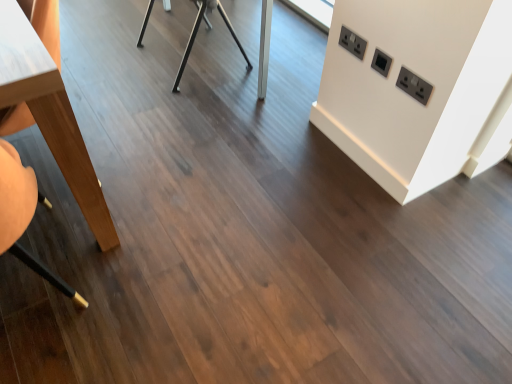
The width and height of the screenshot is (512, 384). What do you see at coordinates (54, 122) in the screenshot?
I see `light brown wood table at left, which is the 1th table in front-to-back order` at bounding box center [54, 122].

What is the approximate width of black plastic electric outlet at upper right, the 2th electric outlet from the right?

black plastic electric outlet at upper right, the 2th electric outlet from the right, is 0.39 inches in width.

What are the coordinates of `black plastic electric outlet at upper right, which ranks as the first electric outlet in bottom-to-top order` in the screenshot? It's located at (414, 86).

Identify the location of light brown wood table at left, placed as the first table when sorted from left to right. (54, 122).

From a real-world perspective, count 2nd tables downward from the black plastic electric outlet at upper right, which is the 3th electric outlet from top to bottom, and point to it. Please provide its 2D coordinates.

[(264, 47)]

Between black plastic electric outlet at upper right, which is the 3th electric outlet from top to bottom, and metallic silver table at center, the 2th table positioned from the front, which one has more height?

metallic silver table at center, the 2th table positioned from the front.

Considering the sizes of objects black plastic electric outlet at upper right, which ranks as the first electric outlet in bottom-to-top order, and metallic silver table at center, which is the 2th table from left to right, in the image provided, who is wider, black plastic electric outlet at upper right, which ranks as the first electric outlet in bottom-to-top order, or metallic silver table at center, which is the 2th table from left to right,?

metallic silver table at center, which is the 2th table from left to right, is wider.

How many degrees apart are the facing directions of black plastic electric outlet at upper right, positioned as the 1th electric outlet in right-to-left order, and metallic silver table at center, placed as the 1th table when sorted from back to front?

167 degrees.

Identify the location of swivel chair located below the black plastic electric outlet at upper right, the 2th electric outlet from the right (from the image's perspective). (23, 215).

Which is more distant, (x=11, y=174) or (x=373, y=58)?

Point (x=373, y=58)

Is wooden swivel chair at left at the left side of black plastic electric outlet at upper right, arranged as the 2th electric outlet when viewed from the left?

Indeed, wooden swivel chair at left is positioned on the left side of black plastic electric outlet at upper right, arranged as the 2th electric outlet when viewed from the left.

Considering the sizes of objects black plastic electric outlet at upper right, the 2th electric outlet from the right, and light brown wood table at left, which appears as the 2th table when viewed from the right, in the image provided, who is wider, black plastic electric outlet at upper right, the 2th electric outlet from the right, or light brown wood table at left, which appears as the 2th table when viewed from the right,?

With larger width is light brown wood table at left, which appears as the 2th table when viewed from the right.

Is point (378, 57) behind point (19, 91)?

Yes, point (378, 57) is behind point (19, 91).

How distant is black plastic electric outlet at upper right, which is counted as the 2th electric outlet, starting from the top, from light brown wood table at left, placed as the first table when sorted from left to right?

They are 1.14 meters apart.

From the picture: Between black plastic electric outlet at upper right, the 2th electric outlet from the right, and light brown wood table at left, placed as the first table when sorted from left to right, which one is positioned in front?

Positioned in front is light brown wood table at left, placed as the first table when sorted from left to right.

Between black plastic/socket at upper right, which is the 1th electric outlet in left-to-right order, and wooden swivel chair at left, which one is positioned in front?

wooden swivel chair at left is closer to the camera.

Can you confirm if black plastic/socket at upper right, which is the 1th electric outlet in left-to-right order, is bigger than wooden swivel chair at left?

Incorrect, black plastic/socket at upper right, which is the 1th electric outlet in left-to-right order, is not larger than wooden swivel chair at left.

How distant is black plastic/socket at upper right, which is the 1th electric outlet in left-to-right order, from wooden swivel chair at left?

black plastic/socket at upper right, which is the 1th electric outlet in left-to-right order, is 1.25 meters from wooden swivel chair at left.

Can you tell me how much black plastic/socket at upper right, which ranks as the first electric outlet in top-to-bottom order, and wooden swivel chair at left differ in facing direction?

They differ by 88.3 degrees in their facing directions.

Can you confirm if black plastic/socket at upper right, positioned as the 3th electric outlet in right-to-left order, is smaller than metallic silver table at center, placed as the 1th table when sorted from back to front?

Indeed, black plastic/socket at upper right, positioned as the 3th electric outlet in right-to-left order, has a smaller size compared to metallic silver table at center, placed as the 1th table when sorted from back to front.

From a real-world perspective, between black plastic/socket at upper right, which ranks as the first electric outlet in top-to-bottom order, and metallic silver table at center, the 2th table positioned from the front, who is vertically higher?

black plastic/socket at upper right, which ranks as the first electric outlet in top-to-bottom order, from a real-world perspective.

Considering the relative sizes of black plastic/socket at upper right, positioned as the 3th electric outlet in right-to-left order, and metallic silver table at center, the 2th table positioned from the front, in the image provided, is black plastic/socket at upper right, positioned as the 3th electric outlet in right-to-left order, wider than metallic silver table at center, the 2th table positioned from the front,?

Incorrect, the width of black plastic/socket at upper right, positioned as the 3th electric outlet in right-to-left order, does not surpass that of metallic silver table at center, the 2th table positioned from the front.

Does black plastic/socket at upper right, which is the 1th electric outlet in left-to-right order, appear on the left side of metallic silver table at center, placed as the 1th table when sorted from back to front?

Incorrect, black plastic/socket at upper right, which is the 1th electric outlet in left-to-right order, is not on the left side of metallic silver table at center, placed as the 1th table when sorted from back to front.

Considering the positions of point (16, 186) and point (4, 32), is point (16, 186) closer or farther from the camera than point (4, 32)?

Point (16, 186) is closer to the camera than point (4, 32).

Based on the photo, considering the relative sizes of wooden swivel chair at left and light brown wood table at left, which is the 1th table in front-to-back order, in the image provided, is wooden swivel chair at left bigger than light brown wood table at left, which is the 1th table in front-to-back order,?

No.

From the image's perspective, relative to light brown wood table at left, which is the 1th table in front-to-back order, is wooden swivel chair at left above or below?

Clearly, from the image's perspective, wooden swivel chair at left is below light brown wood table at left, which is the 1th table in front-to-back order.

Are wooden swivel chair at left and light brown wood table at left, which appears as the 2th table when viewed from the right, making contact?

No, wooden swivel chair at left is not making contact with light brown wood table at left, which appears as the 2th table when viewed from the right.

From the picture: Is the surface of light brown wood table at left, which is the 1th table in front-to-back order, in direct contact with black plastic electric outlet at upper right, marked as the 3th electric outlet in a left-to-right arrangement?

They are not placed beside each other.

Between light brown wood table at left, which appears as the 2th table when viewed from the right, and black plastic electric outlet at upper right, which ranks as the first electric outlet in bottom-to-top order, which one has less height?

With less height is black plastic electric outlet at upper right, which ranks as the first electric outlet in bottom-to-top order.

Is light brown wood table at left, which appears as the 2th table when viewed from the right, smaller than black plastic electric outlet at upper right, positioned as the 1th electric outlet in right-to-left order?

Incorrect, light brown wood table at left, which appears as the 2th table when viewed from the right, is not smaller in size than black plastic electric outlet at upper right, positioned as the 1th electric outlet in right-to-left order.

Is point (16, 81) positioned before point (404, 89)?

Yes, it is in front of point (404, 89).

Starting from the metallic silver table at center, which is the 2th table from left to right, which electric outlet is the 3rd one to the right? Please provide its 2D coordinates.

[(414, 86)]

Locate an element on the screen. The image size is (512, 384). the 2nd electric outlet above the wooden swivel chair at left (from the image's perspective) is located at coordinates (381, 62).

Estimate the real-world distances between objects in this image. Which object is further from wooden swivel chair at left, metallic silver table at center, the 2th table positioned from the front, or black plastic electric outlet at upper right, which ranks as the first electric outlet in bottom-to-top order?

metallic silver table at center, the 2th table positioned from the front, lies further to wooden swivel chair at left than the other object.

In the scene shown: Based on their spatial positions, is black plastic/socket at upper right, which is the 1th electric outlet in left-to-right order, or light brown wood table at left, which is the 1th table in front-to-back order, closer to black plastic electric outlet at upper right, arranged as the 2th electric outlet when viewed from the left?

black plastic/socket at upper right, which is the 1th electric outlet in left-to-right order, lies closer to black plastic electric outlet at upper right, arranged as the 2th electric outlet when viewed from the left, than the other object.

Based on their spatial positions, is black plastic electric outlet at upper right, which ranks as the first electric outlet in bottom-to-top order, or black plastic/socket at upper right, which is the third electric outlet in bottom-to-top order, further from light brown wood table at left, placed as the first table when sorted from left to right?

black plastic electric outlet at upper right, which ranks as the first electric outlet in bottom-to-top order, is further to light brown wood table at left, placed as the first table when sorted from left to right.

Which object lies nearer to the anchor point black plastic electric outlet at upper right, marked as the 3th electric outlet in a left-to-right arrangement, black plastic electric outlet at upper right, arranged as the 2th electric outlet when viewed from the left, or metallic silver table at center, placed as the 1th table when sorted from back to front?

Based on the image, black plastic electric outlet at upper right, arranged as the 2th electric outlet when viewed from the left, appears to be nearer to black plastic electric outlet at upper right, marked as the 3th electric outlet in a left-to-right arrangement.

Looking at the image, which one is located closer to wooden swivel chair at left, black plastic electric outlet at upper right, marked as the 3th electric outlet in a left-to-right arrangement, or light brown wood table at left, which appears as the 2th table when viewed from the right?

Based on the image, light brown wood table at left, which appears as the 2th table when viewed from the right, appears to be nearer to wooden swivel chair at left.

Considering their positions, is metallic silver table at center, the first table viewed from the right, positioned further to light brown wood table at left, placed as the first table when sorted from left to right, than black plastic electric outlet at upper right, positioned as the 1th electric outlet in right-to-left order?

The object further to light brown wood table at left, placed as the first table when sorted from left to right, is black plastic electric outlet at upper right, positioned as the 1th electric outlet in right-to-left order.

Based on their spatial positions, is black plastic electric outlet at upper right, positioned as the 1th electric outlet in right-to-left order, or black plastic electric outlet at upper right, which is counted as the 2th electric outlet, starting from the top, closer to light brown wood table at left, placed as the first table when sorted from left to right?

black plastic electric outlet at upper right, which is counted as the 2th electric outlet, starting from the top, lies closer to light brown wood table at left, placed as the first table when sorted from left to right, than the other object.

When comparing their distances from metallic silver table at center, the first table viewed from the right, does black plastic electric outlet at upper right, which ranks as the first electric outlet in bottom-to-top order, or wooden swivel chair at left seem closer?

black plastic electric outlet at upper right, which ranks as the first electric outlet in bottom-to-top order, is positioned closer to the anchor metallic silver table at center, the first table viewed from the right.

Find the location of a particular element. Image resolution: width=512 pixels, height=384 pixels. table between light brown wood table at left, which is the 1th table in front-to-back order, and black plastic electric outlet at upper right, arranged as the 2th electric outlet when viewed from the left, in the horizontal direction is located at coordinates (264, 47).

Locate an element on the screen. This screenshot has width=512, height=384. swivel chair between light brown wood table at left, placed as the first table when sorted from left to right, and black plastic electric outlet at upper right, arranged as the 2th electric outlet when viewed from the left is located at coordinates (23, 215).

Where is `swivel chair situated between light brown wood table at left, the 2th table viewed from the back, and black plastic electric outlet at upper right, which ranks as the first electric outlet in bottom-to-top order, from left to right`? This screenshot has width=512, height=384. swivel chair situated between light brown wood table at left, the 2th table viewed from the back, and black plastic electric outlet at upper right, which ranks as the first electric outlet in bottom-to-top order, from left to right is located at coordinates (23, 215).

Where is `electric outlet between black plastic/socket at upper right, which is the third electric outlet in bottom-to-top order, and black plastic electric outlet at upper right, marked as the 3th electric outlet in a left-to-right arrangement, vertically`? electric outlet between black plastic/socket at upper right, which is the third electric outlet in bottom-to-top order, and black plastic electric outlet at upper right, marked as the 3th electric outlet in a left-to-right arrangement, vertically is located at coordinates click(x=381, y=62).